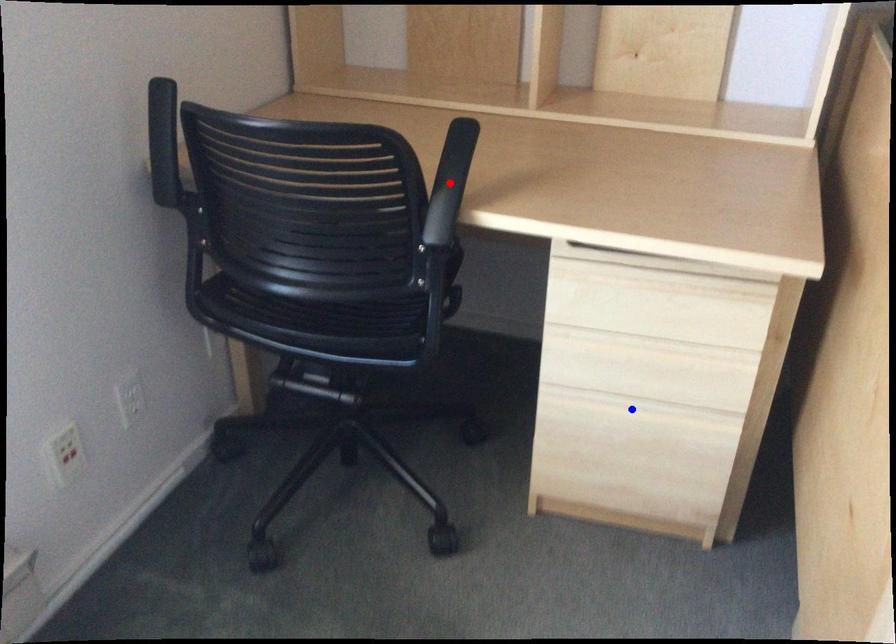
Question: Two points are marked on the image. Which point is closer to the camera?

Choices:
 (A) Blue point is closer.
 (B) Red point is closer.

Answer: (B)